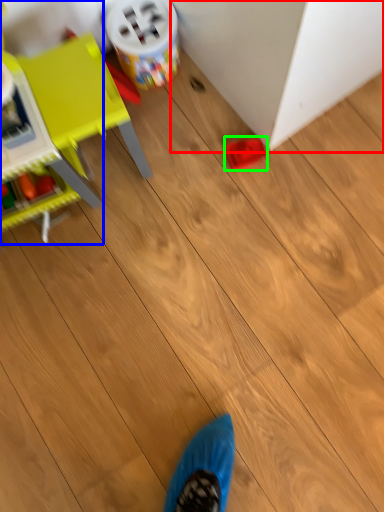
Question: Considering the real-world distances, which object is farthest from furniture (highlighted by a red box)? toy (highlighted by a blue box) or toy (highlighted by a green box)?

Choices:
 (A) toy
 (B) toy

Answer: (A)